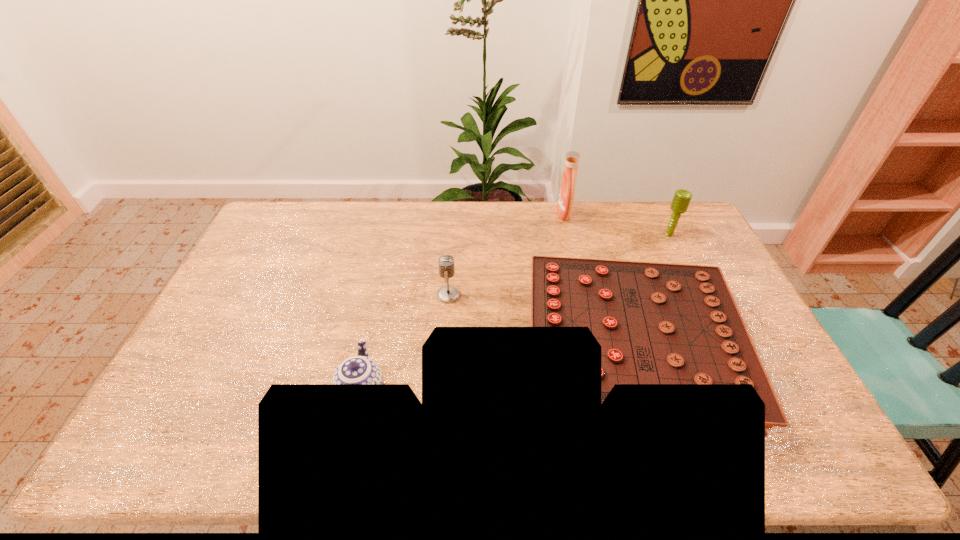
Locate an element on the screen. This screenshot has height=540, width=960. gameboard that is at the near edge is located at coordinates (657, 323).

Find the location of a particular element. microphone located in the right edge section of the desktop is located at coordinates (682, 198).

Image resolution: width=960 pixels, height=540 pixels. I want to click on gameboard present at the right edge, so click(x=657, y=323).

This screenshot has height=540, width=960. I want to click on object located at the far right corner, so click(682, 198).

Find the location of a particular element. This screenshot has height=540, width=960. object present at the near right corner is located at coordinates (657, 323).

Find the location of a particular element. vacant area at the far edge of the desktop is located at coordinates coord(559,225).

Find the location of `vacant area at the near edge`. vacant area at the near edge is located at coordinates [x=746, y=447].

Where is `vacant region at the left edge of the desktop`? vacant region at the left edge of the desktop is located at coordinates (258, 252).

Where is `blank space at the far left corner`? This screenshot has height=540, width=960. blank space at the far left corner is located at coordinates (296, 218).

Identify the location of free space at the far right corner of the desktop. The image size is (960, 540). (693, 220).